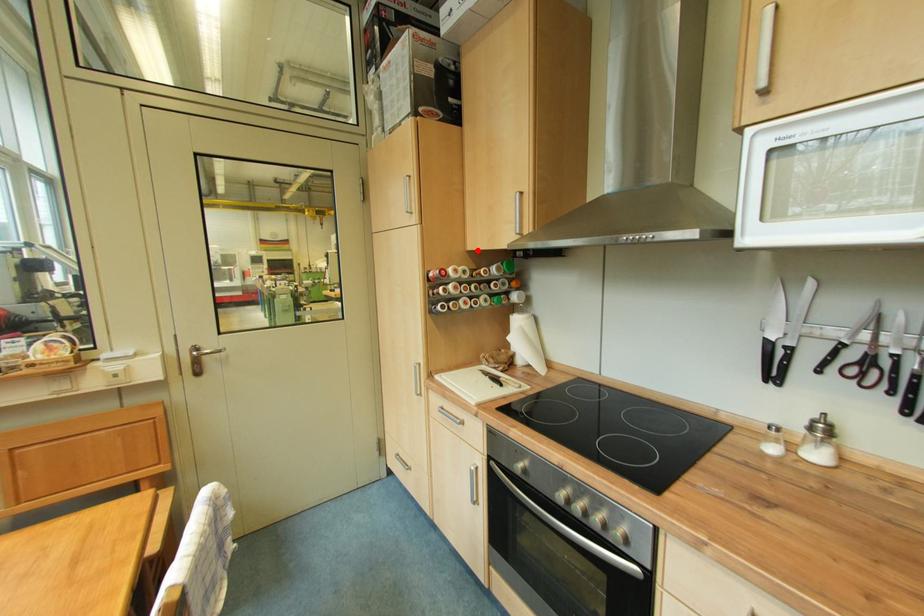
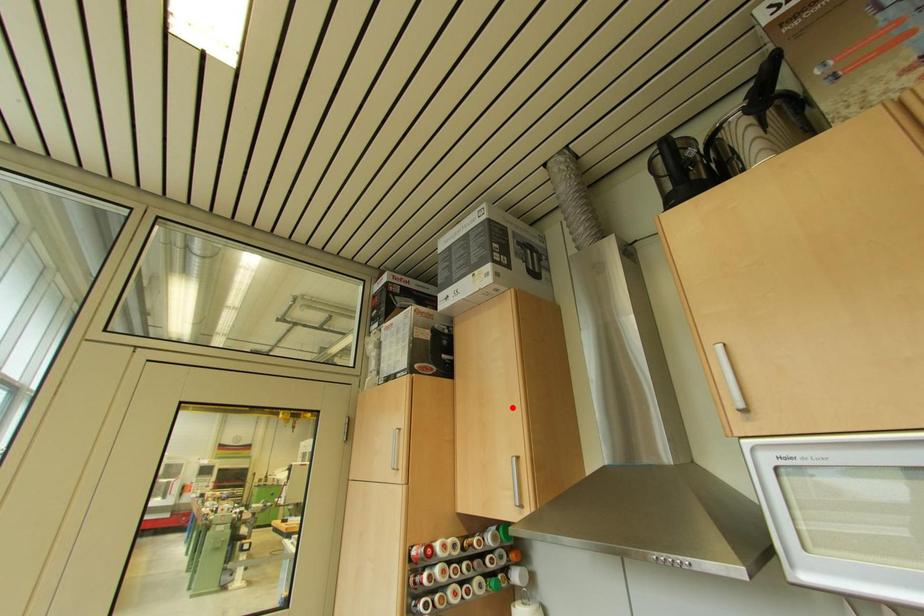
I am providing you with two images of the same scene from different viewpoints. A red point is marked on the first image and another point is marked on the second image. Does the point marked in image1 correspond to the same location as the one in image2?

No